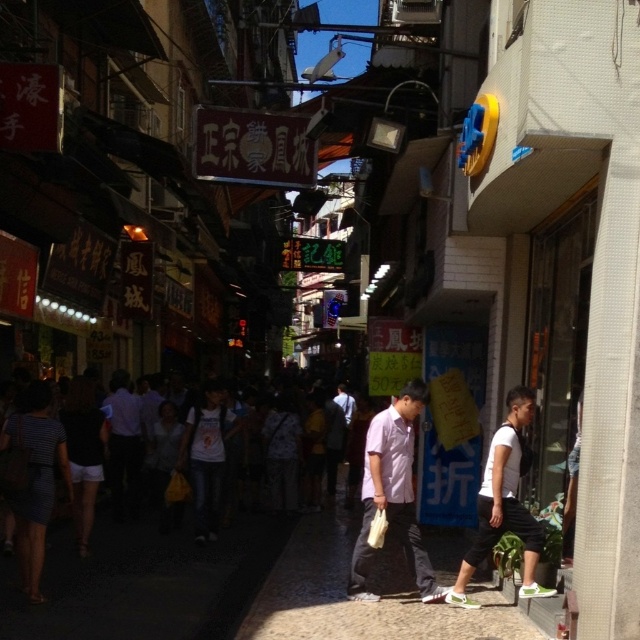
Question: Which object is the farthest from the smooth concrete pavement at center?

Choices:
 (A) white matte shirt at center
 (B) matte white shirt at center
 (C) dark gray clothing at center

Answer: (C)

Question: Which point appears closest to the camera in this image?

Choices:
 (A) (240, 627)
 (B) (512, 422)
 (C) (412, 538)

Answer: (A)

Question: Can you confirm if smooth concrete pavement at center is thinner than matte white shirt at center?

Choices:
 (A) yes
 (B) no

Answer: (B)

Question: Among these objects, which one is farthest from the camera?

Choices:
 (A) dark gray clothing at center
 (B) white matte shirt at center
 (C) matte white shirt at center

Answer: (A)

Question: Considering the relative positions of smooth concrete pavement at center and dark gray clothing at center in the image provided, where is smooth concrete pavement at center located with respect to dark gray clothing at center?

Choices:
 (A) left
 (B) right

Answer: (B)

Question: Considering the relative positions of matte white shirt at center and white matte shirt at center in the image provided, where is matte white shirt at center located with respect to white matte shirt at center?

Choices:
 (A) above
 (B) below

Answer: (B)